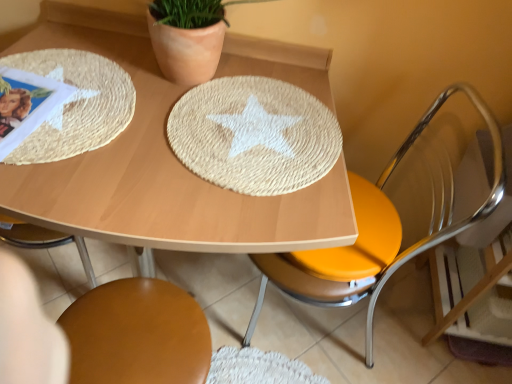
What are the coordinates of `empty space that is ontop of woven straw placemat at center (from a real-world perspective)` in the screenshot? It's located at coord(261,128).